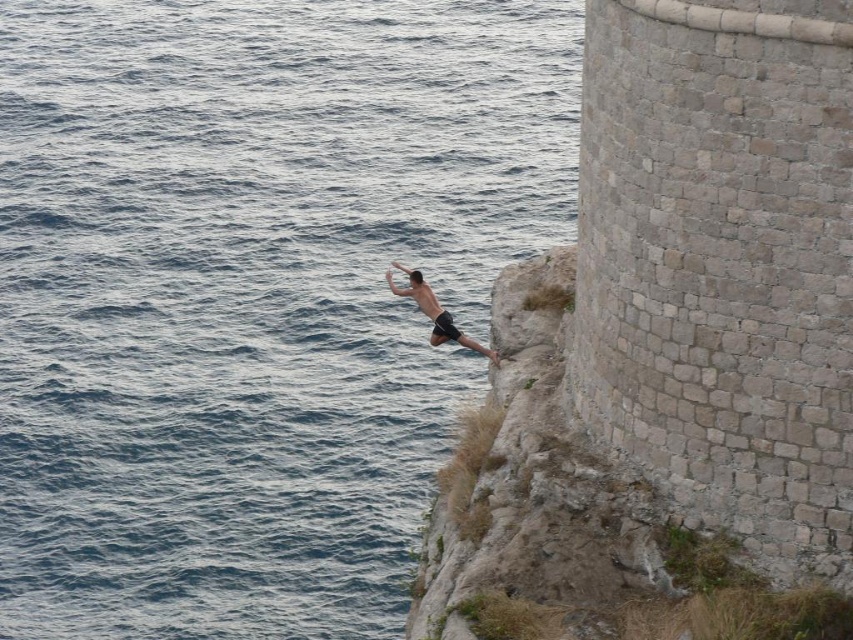
You are standing on a cliff and see the blue water at left. If you want to jump into the water, how far will you have to jump horizontally?

The blue water at left is 35.14 meters away from the viewer, so you would need to jump approximately 35.14 meters horizontally to reach it.

In the scene shown: You are standing on the cliff and want to jump into the blue water at left. Based on the coordinates provided in the description, where exactly should you aim to land?

The blue water at left is located at point (x=252, y=294), so you should aim for that coordinate to land safely in the blue water at left.